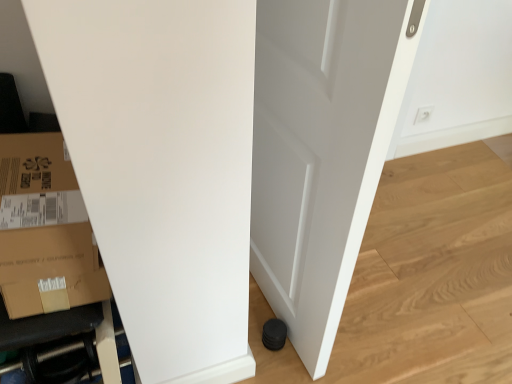
Question: Would you say white matte door at center is to the left or to the right of black rubber hose at lower left in the picture?

Choices:
 (A) right
 (B) left

Answer: (A)

Question: In the image, is white matte door at center positioned in front of or behind black rubber hose at lower left?

Choices:
 (A) front
 (B) behind

Answer: (A)

Question: Which of these objects is positioned farthest from the black rubber hose at lower left?

Choices:
 (A) brown cardboard box at lower left
 (B) white matte door at center
 (C) white plastic electric outlet at upper right

Answer: (C)

Question: Estimate the real-world distances between objects in this image. Which object is closer to the black rubber hose at lower left?

Choices:
 (A) brown cardboard box at lower left
 (B) white matte door at center
 (C) white plastic electric outlet at upper right

Answer: (A)